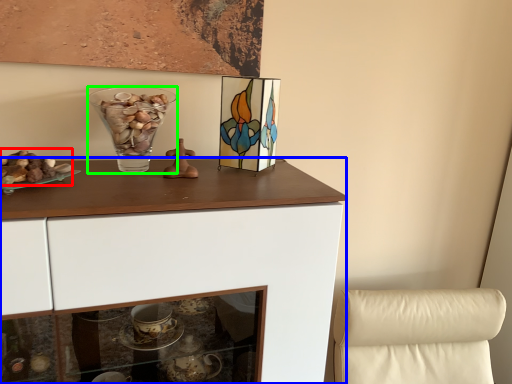
Question: Which is farther away from stuff (highlighted by a red box)? cabinetry (highlighted by a blue box) or vase (highlighted by a green box)?

Choices:
 (A) cabinetry
 (B) vase

Answer: (A)